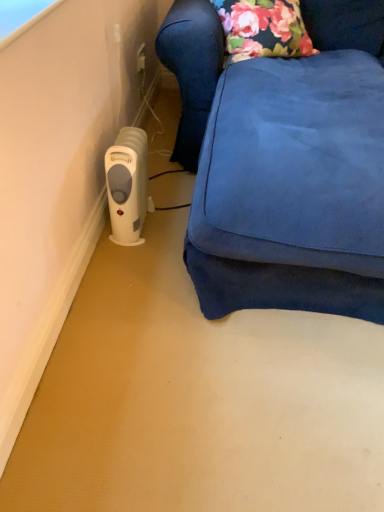
Question: Considering the positions of white plastic heater at lower left and white plastic heater at left in the image, is white plastic heater at lower left taller or shorter than white plastic heater at left?

Choices:
 (A) short
 (B) tall

Answer: (A)

Question: Looking at their shapes, would you say white plastic heater at lower left is wider or thinner than white plastic heater at left?

Choices:
 (A) wide
 (B) thin

Answer: (B)

Question: Looking at the image, does white plastic heater at lower left seem bigger or smaller compared to white plastic heater at left?

Choices:
 (A) big
 (B) small

Answer: (B)

Question: Is point (248, 86) closer or farther from the camera than point (127, 159)?

Choices:
 (A) farther
 (B) closer

Answer: (A)

Question: Is white plastic heater at left taller or shorter than white plastic heater at lower left?

Choices:
 (A) tall
 (B) short

Answer: (A)

Question: Is white plastic heater at left in front of or behind white plastic heater at lower left in the image?

Choices:
 (A) front
 (B) behind

Answer: (A)

Question: From the image's perspective, is white plastic heater at left positioned above or below white plastic heater at lower left?

Choices:
 (A) above
 (B) below

Answer: (A)